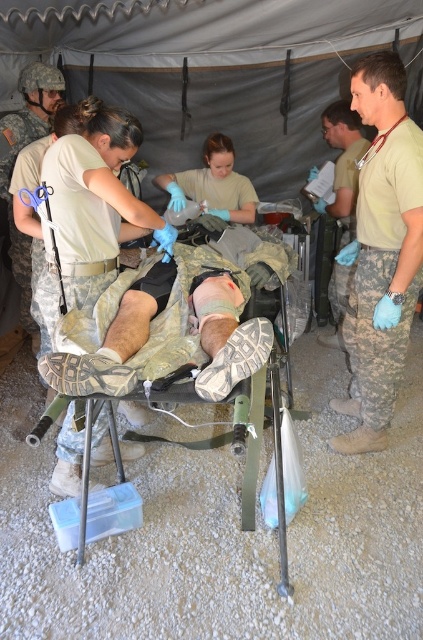
Does camouflage uniform at right appear on the left side of tan uniform at right?

Correct, you'll find camouflage uniform at right to the left of tan uniform at right.

Is camouflage uniform at right shorter than tan uniform at right?

No.

Who is more distant from viewer, [414,278] or [321,342]?

The point [321,342] is more distant.

The image size is (423, 640). Find the location of `camouflage uniform at right`. camouflage uniform at right is located at coordinates (381, 252).

Between camouflage fabric uniform at center and tan uniform at right, which one has less height?

Standing shorter between the two is tan uniform at right.

Can you confirm if camouflage fabric uniform at center is positioned below tan uniform at right?

Yes, camouflage fabric uniform at center is below tan uniform at right.

Is point (136, 294) in front of point (364, 138)?

Yes, point (136, 294) is in front of point (364, 138).

You are a GUI agent. You are given a task and a screenshot of the screen. Output one action in this format:
    pyautogui.click(x=<x>, y=<y>)
    Task: Click on the camouflage fabric uniform at center
    Image resolution: width=423 pixels, height=640 pixels.
    Given the screenshot: What is the action you would take?
    pyautogui.click(x=96, y=198)

Can you confirm if camouflage uniform at right is positioned to the left of matte blue gloves at center?

No, camouflage uniform at right is not to the left of matte blue gloves at center.

Does point (332, 445) lie behind point (178, 209)?

No, (332, 445) is closer to viewer.

Does point (368, 109) come farther from viewer compared to point (213, 164)?

No, (368, 109) is in front of (213, 164).

Where is `camouflage uniform at right`? The height and width of the screenshot is (640, 423). camouflage uniform at right is located at coordinates (381, 252).